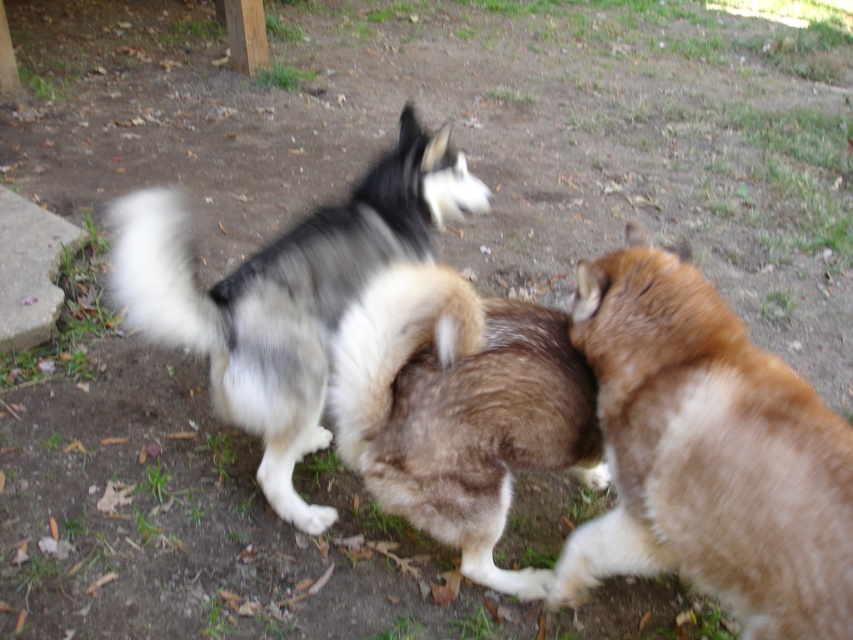
You are a photographer trying to capture a group photo of the fuzzy brown dog at center and the black and white fur dog at center. To ensure both are in frame, should you position yourself to the left or the right of the dogs?

You should position yourself to the left of the dogs because the fuzzy brown dog at center is to the right of the black and white fur dog at center, so placing yourself to the left would keep both in the frame.